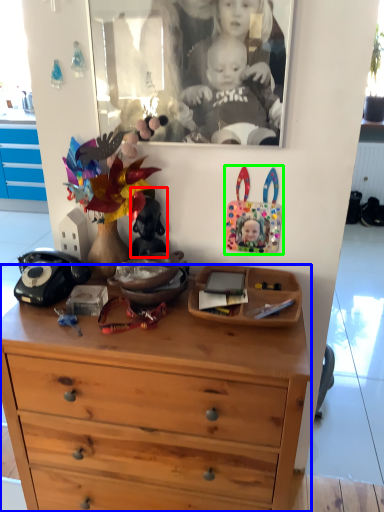
Question: Which is nearer to the toy (highlighted by a red box)? chest of drawers (highlighted by a blue box) or toy (highlighted by a green box).

Choices:
 (A) chest of drawers
 (B) toy

Answer: (B)